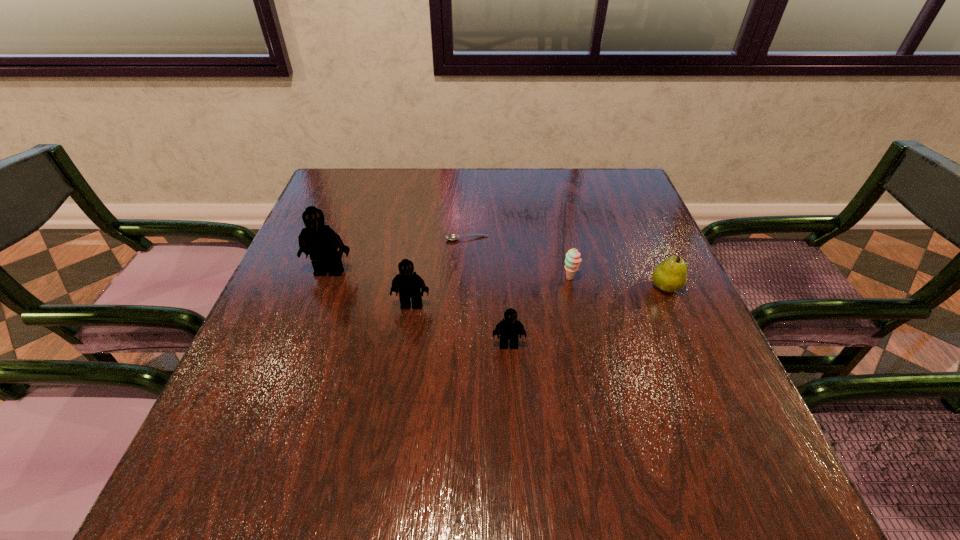
Find the location of `free spot located 0.150m on the face of the leftmost object`. free spot located 0.150m on the face of the leftmost object is located at coordinates (308, 327).

Locate an element on the screen. blank space located on the face of the fifth farthest object is located at coordinates (404, 352).

At what (x,y) coordinates should I click in order to perform the action: click on free point located 0.120m on the face of the nearest object. Please return your answer as a coordinate pair (x, y). The height and width of the screenshot is (540, 960). Looking at the image, I should click on (513, 404).

Where is `vacant point located on the right of the fifth object from left to right`? The width and height of the screenshot is (960, 540). vacant point located on the right of the fifth object from left to right is located at coordinates (660, 278).

What are the coordinates of `free region located 0.090m on the left of the shortest object` in the screenshot? It's located at (410, 239).

Image resolution: width=960 pixels, height=540 pixels. Find the location of `blank space located 0.320m on the left of the pear`. blank space located 0.320m on the left of the pear is located at coordinates (507, 287).

In order to click on object present at the left edge in this screenshot , I will do `click(321, 242)`.

I want to click on object at the right edge, so point(670,275).

You are a GUI agent. You are given a task and a screenshot of the screen. Output one action in this format:
    pyautogui.click(x=<x>, y=<y>)
    Task: Click on the vacant space at the far edge of the desktop
    
    Given the screenshot: What is the action you would take?
    click(491, 206)

Find the location of `free space at the left edge of the desktop`. free space at the left edge of the desktop is located at coordinates (364, 238).